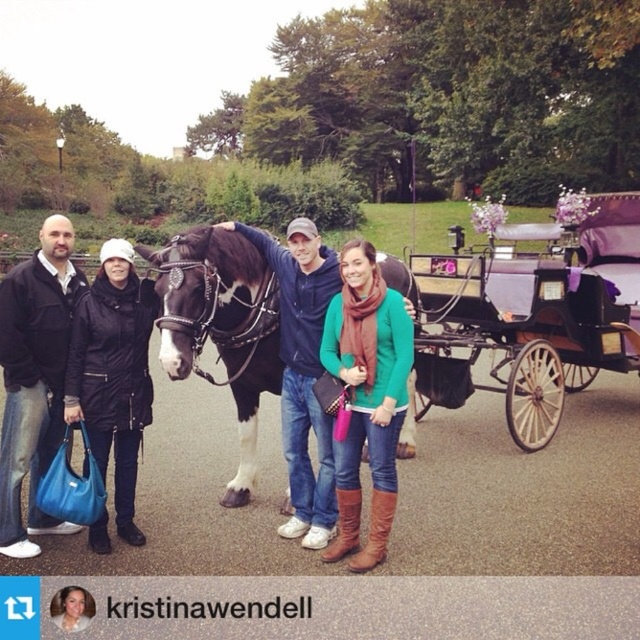
Question: Can you confirm if black glossy horse at center is positioned above black leather coat at left?

Choices:
 (A) no
 (B) yes

Answer: (A)

Question: Is green matte sweater at center below matte black jacket at left?

Choices:
 (A) yes
 (B) no

Answer: (A)

Question: Estimate the real-world distances between objects in this image. Which object is farther from the matte black jacket at left?

Choices:
 (A) black glossy horse at center
 (B) green matte sweater at center
 (C) black leather coat at left
 (D) purple satin horse cart at right

Answer: (D)

Question: Can you confirm if matte black jacket at left is positioned above black leather coat at left?

Choices:
 (A) no
 (B) yes

Answer: (B)

Question: Which point is farther to the camera?

Choices:
 (A) (337, 316)
 (B) (56, 269)

Answer: (B)

Question: Among these objects, which one is nearest to the camera?

Choices:
 (A) purple satin horse cart at right
 (B) green matte sweater at center

Answer: (B)